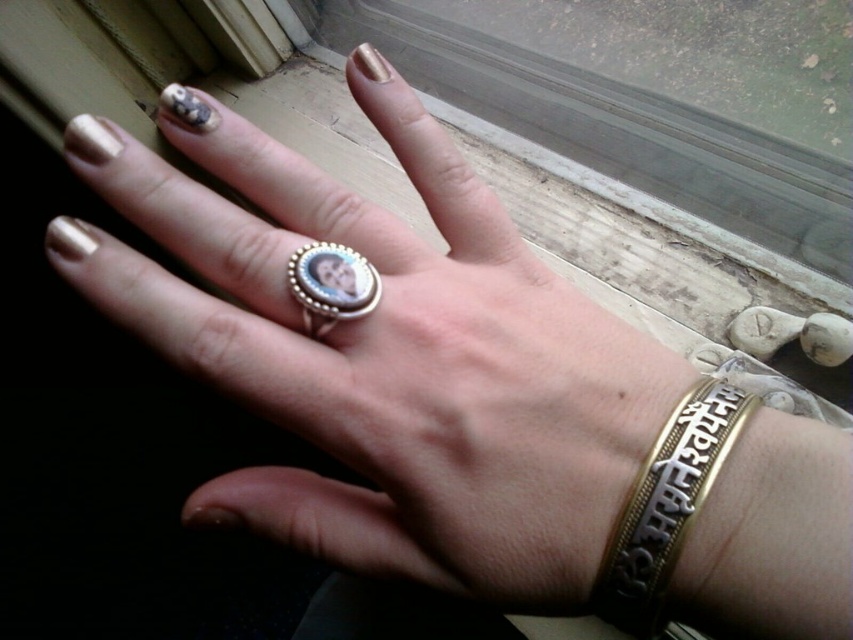
Who is positioned more to the left, transparent glass window at upper center or silver/golden ring at center?

From the viewer's perspective, silver/golden ring at center appears more on the left side.

Who is lower down, transparent glass window at upper center or silver/golden ring at center?

silver/golden ring at center is lower down.

This screenshot has width=853, height=640. What are the coordinates of `transparent glass window at upper center` in the screenshot? It's located at (648, 205).

Where is `transparent glass window at upper center`? Image resolution: width=853 pixels, height=640 pixels. transparent glass window at upper center is located at coordinates coord(648,205).

Is matte silver ring at center to the right of gold textured bracelet at lower right from the viewer's perspective?

In fact, matte silver ring at center is to the left of gold textured bracelet at lower right.

Which is above, matte silver ring at center or gold textured bracelet at lower right?

matte silver ring at center

Who is more distant from viewer, [334,560] or [621,515]?

Positioned behind is point [334,560].

What are the coordinates of `matte silver ring at center` in the screenshot? It's located at (383, 353).

Is matte silver ring at center behind silver/golden ring at center?

No.

The width and height of the screenshot is (853, 640). In order to click on matte silver ring at center in this screenshot , I will do `click(383, 353)`.